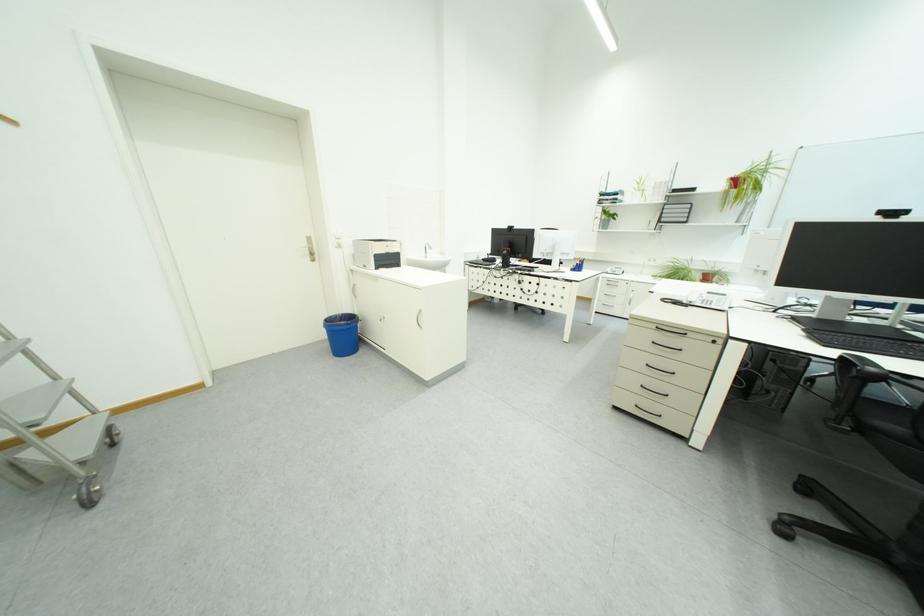
Where would you lift the telephone handset? Please return your answer as a coordinate pair (x, y).

(694, 294)